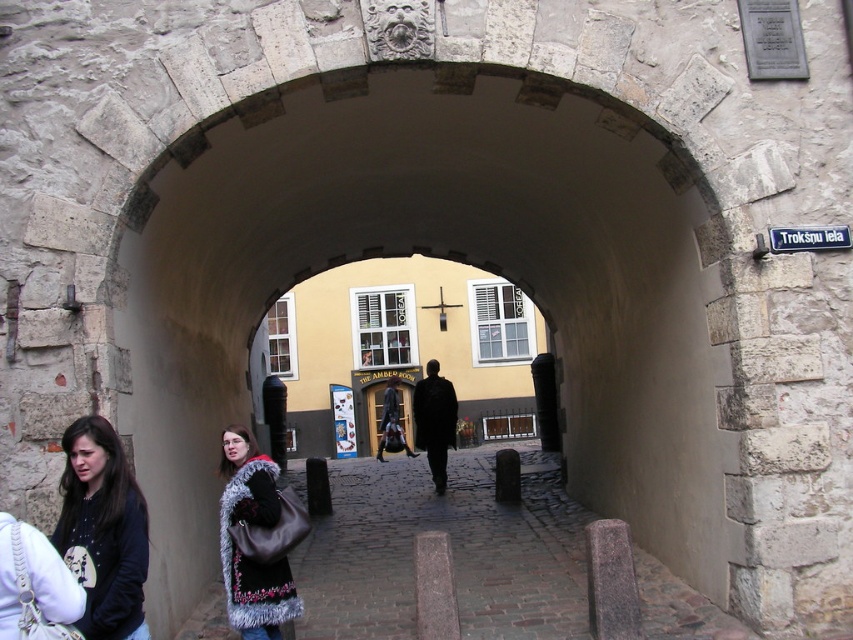
Does point (421, 403) come in front of point (845, 232)?

No.

Find the location of a particular element. Image resolution: width=853 pixels, height=640 pixels. dark brown leather coat at center is located at coordinates (434, 420).

Find the location of a particular element. The width and height of the screenshot is (853, 640). dark brown leather coat at center is located at coordinates (434, 420).

Is fuzzy black coat at center wider than dark brown leather coat at center?

Incorrect, fuzzy black coat at center's width does not surpass dark brown leather coat at center's.

Is point (276, 637) positioned behind point (440, 442)?

No, (276, 637) is in front of (440, 442).

Does point (271, 493) come closer to viewer compared to point (450, 396)?

That is True.

You are a GUI agent. You are given a task and a screenshot of the screen. Output one action in this format:
    pyautogui.click(x=<x>, y=<y>)
    Task: Click on the fuzzy black coat at center
    The height and width of the screenshot is (640, 853).
    Given the screenshot: What is the action you would take?
    pyautogui.click(x=253, y=525)

Which is below, dark brown hair at left or white plastic street sign at upper right?

dark brown hair at left

Can you confirm if dark brown hair at left is smaller than white plastic street sign at upper right?

No.

Find the location of a particular element. This screenshot has height=640, width=853. dark brown hair at left is located at coordinates (103, 531).

At what (x,y) coordinates should I click in order to perform the action: click on dark brown hair at left. Please return your answer as a coordinate pair (x, y). Looking at the image, I should click on click(x=103, y=531).